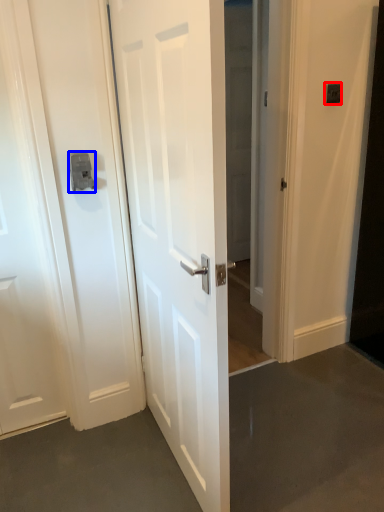
Question: Among these objects, which one is nearest to the camera, light switch (highlighted by a red box) or latch (highlighted by a blue box)?

Choices:
 (A) light switch
 (B) latch

Answer: (B)